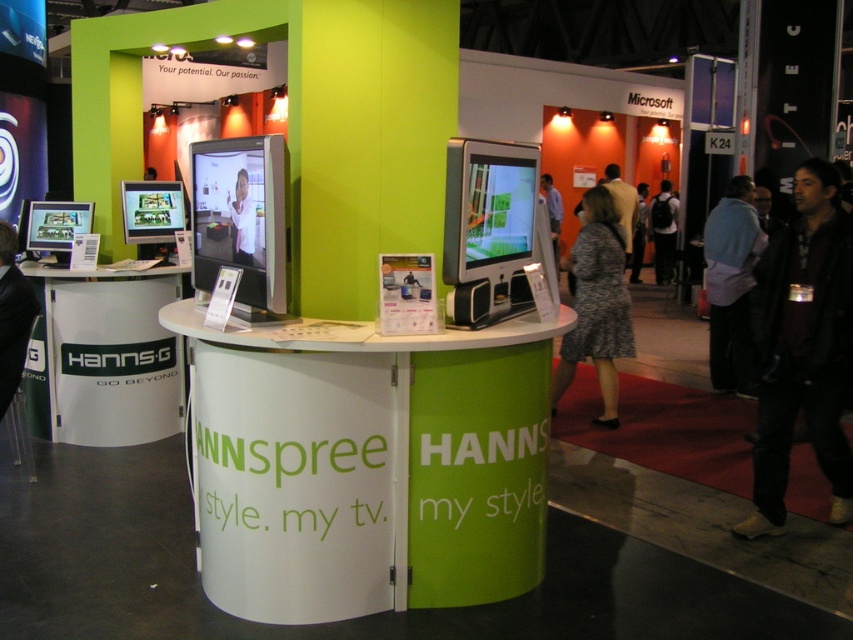
Can you confirm if patterned fabric dress at center is shorter than black backpack at center?

Indeed, patterned fabric dress at center has a lesser height compared to black backpack at center.

In order to click on patterned fabric dress at center in this screenshot , I will do `click(596, 304)`.

Is blue fabric jacket at right below black backpack at center?

Yes, blue fabric jacket at right is below black backpack at center.

Which is behind, point (734, 291) or point (669, 220)?

Positioned behind is point (669, 220).

Is point (708, 257) farther from viewer compared to point (659, 204)?

No.

Where is `blue fabric jacket at right`? The image size is (853, 640). blue fabric jacket at right is located at coordinates (730, 284).

Which is behind, point (775, 296) or point (733, 196)?

Point (733, 196)

At what (x,y) coordinates should I click in order to perform the action: click on dark brown leather jacket at lower right. Please return your answer as a coordinate pair (x, y). Looking at the image, I should click on (804, 348).